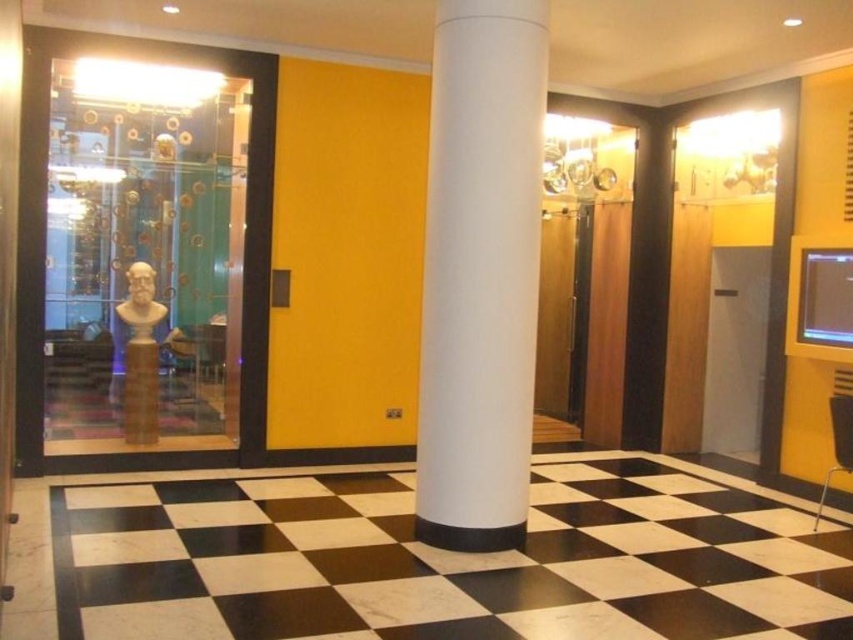
Which is below, white smooth column at center or matte gold bust at left?

matte gold bust at left

At what (x,y) coordinates should I click in order to perform the action: click on white smooth column at center. Please return your answer as a coordinate pair (x, y). This screenshot has width=853, height=640. Looking at the image, I should click on (480, 273).

The width and height of the screenshot is (853, 640). I want to click on white smooth column at center, so click(x=480, y=273).

The image size is (853, 640). Describe the element at coordinates (144, 256) in the screenshot. I see `transparent glass bust at left` at that location.

Which is more to the right, transparent glass bust at left or satin gold bust at left?

transparent glass bust at left

Identify the location of transparent glass bust at left. The image size is (853, 640). (144, 256).

Where is `transparent glass bust at left`? transparent glass bust at left is located at coordinates (144, 256).

Which is above, satin gold bust at left or matte gold bust at left?

matte gold bust at left is higher up.

Does satin gold bust at left lie behind matte gold bust at left?

Yes, it is behind matte gold bust at left.

Is point (137, 262) more distant than point (138, 308)?

No, it is in front of (138, 308).

This screenshot has width=853, height=640. I want to click on satin gold bust at left, so pos(140,355).